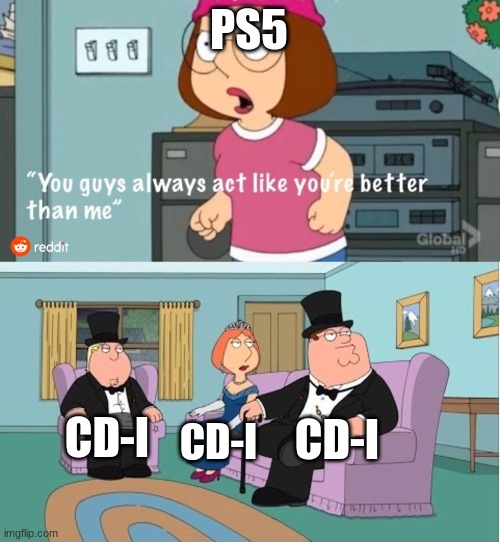
Locate an element on the screen. blue wall is located at coordinates (499, 379), (463, 372), (19, 351).